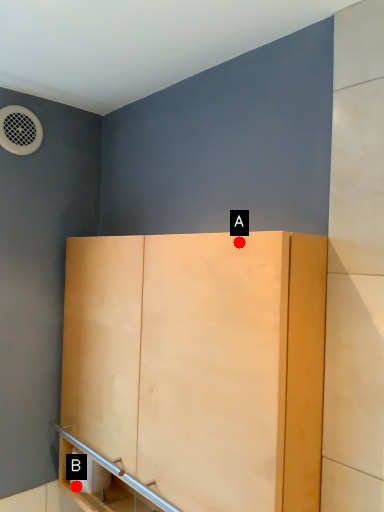
Question: Two points are circled on the image, labeled by A and B beside each circle. Which point appears closest to the camera in this image?

Choices:
 (A) A is closer
 (B) B is closer

Answer: (A)